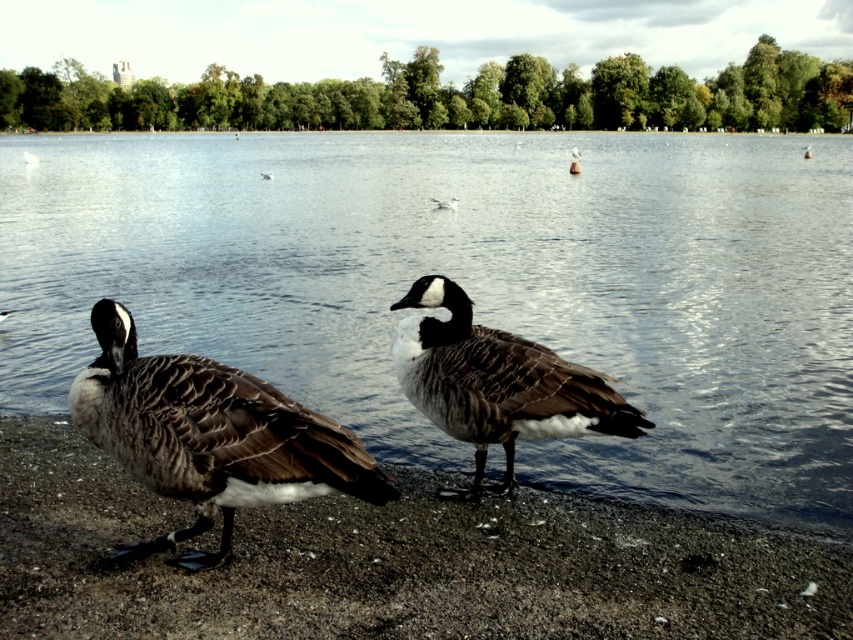
Question: Which object is closer to the camera taking this photo?

Choices:
 (A) white feathered duck at center
 (B) white feathered bird at center
 (C) brown feathered duck at center

Answer: (C)

Question: Is dark brown feathered duck at center positioned at the back of brown feathered goose at lower left?

Choices:
 (A) no
 (B) yes

Answer: (A)

Question: Does smooth water at center have a greater width compared to brown feathered goose at lower left?

Choices:
 (A) yes
 (B) no

Answer: (A)

Question: Which object is farther from the camera taking this photo?

Choices:
 (A) brown feathered duck at center
 (B) dark brown feathered duck at center
 (C) white feathered bird at center

Answer: (C)

Question: Based on their relative distances, which object is farther from the smooth water at center?

Choices:
 (A) brown feathered duck at center
 (B) white feathered duck at center
 (C) smooth sand shoreline at lower center

Answer: (B)

Question: Is dark brown feathered duck at center bigger than white feathered duck at center?

Choices:
 (A) no
 (B) yes

Answer: (B)